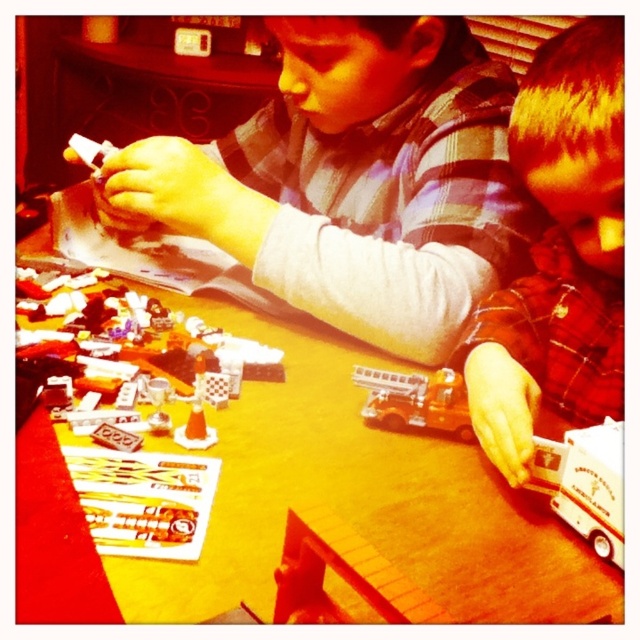
Does matte black toy car at center have a smaller size compared to metallic silver firetruck at center?

Actually, matte black toy car at center might be larger than metallic silver firetruck at center.

Does matte black toy car at center have a larger size compared to metallic silver firetruck at center?

Yes.

Describe the element at coordinates (355, 180) in the screenshot. The image size is (640, 640). I see `matte black toy car at center` at that location.

Where is `matte black toy car at center`? matte black toy car at center is located at coordinates (355, 180).

Describe the element at coordinates (560, 253) in the screenshot. I see `matte plastic toy car at lower right` at that location.

Who is more distant from viewer, (545,356) or (588,490)?

Positioned behind is point (545,356).

At what (x,y) coordinates should I click in order to perform the action: click on matte plastic toy car at lower right. Please return your answer as a coordinate pair (x, y). The height and width of the screenshot is (640, 640). Looking at the image, I should click on (560, 253).

This screenshot has height=640, width=640. Describe the element at coordinates (292, 512) in the screenshot. I see `yellow matte table at center` at that location.

Is point (72, 384) positioned behind point (563, 45)?

No, it is in front of (563, 45).

You are a GUI agent. You are given a task and a screenshot of the screen. Output one action in this format:
    pyautogui.click(x=<x>, y=<y>)
    Task: Click on the yellow matte table at center
    The width and height of the screenshot is (640, 640).
    Given the screenshot: What is the action you would take?
    pyautogui.click(x=292, y=512)